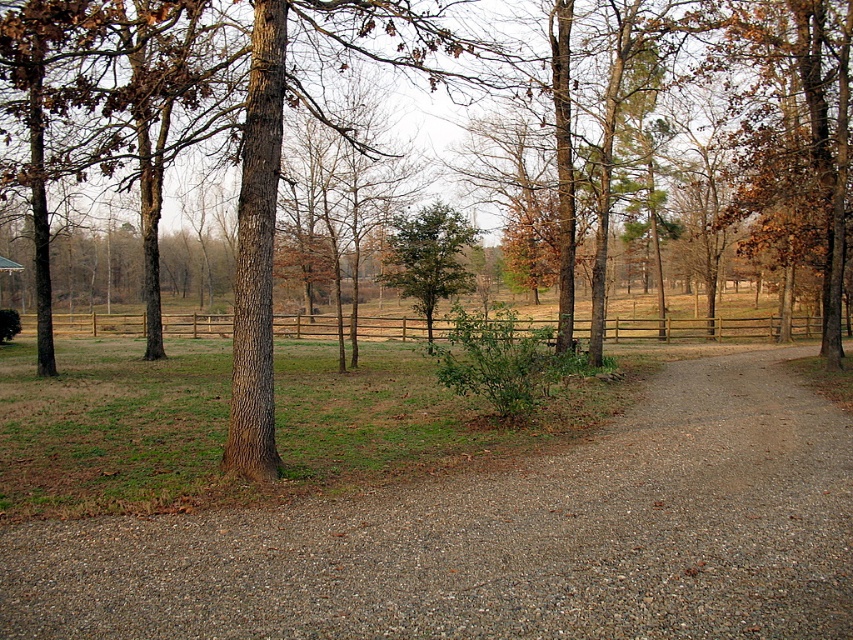
Question: Can you confirm if brown gravel path at center is positioned to the left of green leafy tree at center?

Choices:
 (A) no
 (B) yes

Answer: (A)

Question: Can you confirm if brown wooden fence at center is positioned below green leafy tree at center?

Choices:
 (A) no
 (B) yes

Answer: (B)

Question: Which point is closer to the camera taking this photo?

Choices:
 (A) (383, 627)
 (B) (381, 276)

Answer: (A)

Question: Can you confirm if brown gravel path at center is positioned to the left of green leafy tree at center?

Choices:
 (A) yes
 (B) no

Answer: (B)

Question: Which of the following is the farthest from the observer?

Choices:
 (A) brown gravel path at center
 (B) green leafy tree at center
 (C) brown wooden fence at center

Answer: (B)

Question: Which point is farther to the camera?

Choices:
 (A) (410, 321)
 (B) (422, 289)
 (C) (79, 595)

Answer: (A)